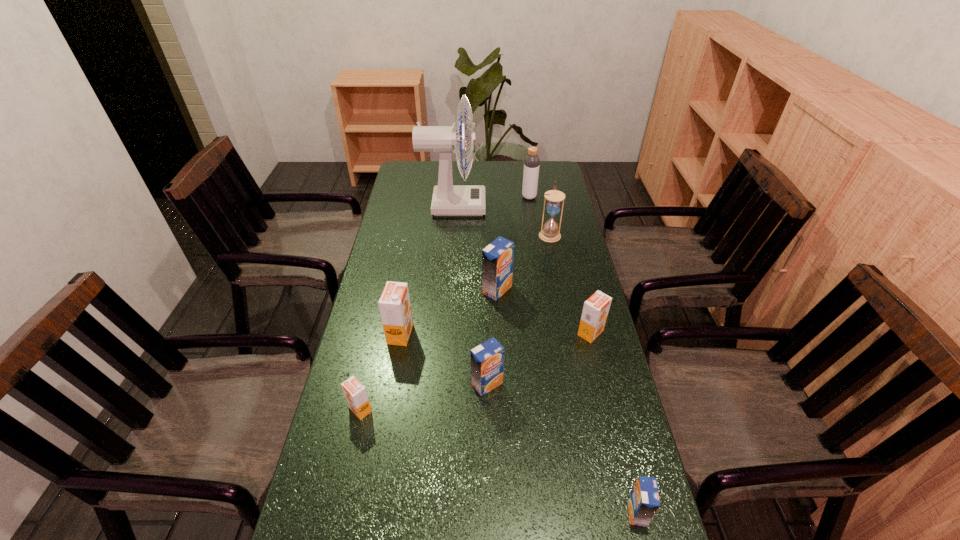
What are the coordinates of `blue fan` in the screenshot? It's located at (448, 200).

Find the location of a particular element. This screenshot has width=960, height=540. the tallest object is located at coordinates [448, 200].

Where is `gray bottle`? gray bottle is located at coordinates (532, 161).

The height and width of the screenshot is (540, 960). Identify the location of white hourglass. (550, 233).

Find the location of `the farthest orange juice`. the farthest orange juice is located at coordinates (497, 258).

Where is `the farthest blue orange_juice`? The image size is (960, 540). the farthest blue orange_juice is located at coordinates (497, 258).

At what (x,y) coordinates should I click in order to perform the action: click on the biggest orange orange juice. Please return your answer as a coordinate pair (x, y). The width and height of the screenshot is (960, 540). Looking at the image, I should click on (394, 304).

The image size is (960, 540). I want to click on the fifth orange juice from right to left, so click(x=394, y=304).

Identify the location of the third nearest orange juice. (487, 359).

Identify the location of the second farthest blue orange_juice. (487, 359).